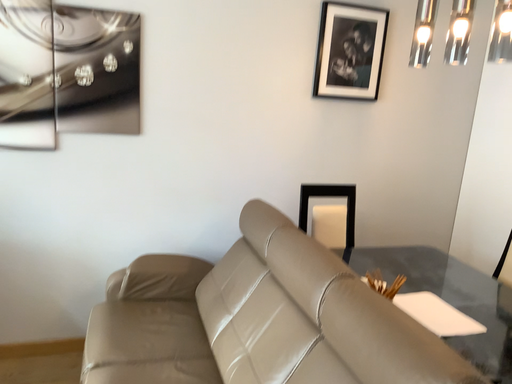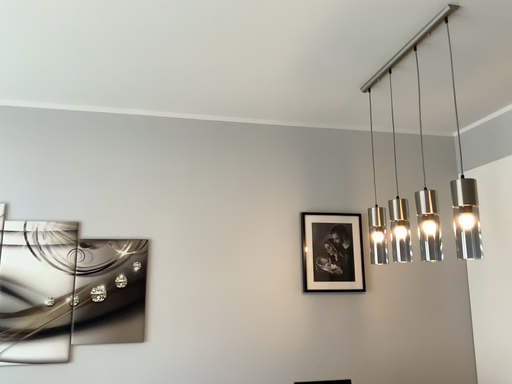
Question: Which way did the camera rotate in the video?

Choices:
 (A) rotated right
 (B) rotated left

Answer: (B)